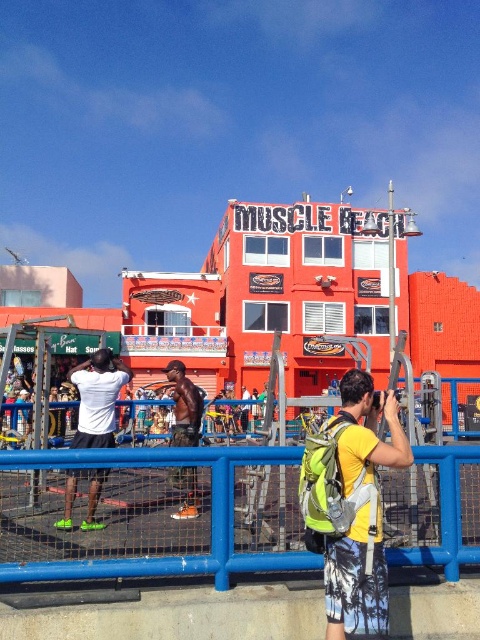
You are a photographer at Muscle Beach and need to capture both the black matte shorts at center and the shiny black shorts at center in a single frame. Which pair of shorts will appear smaller in the photo?

The black matte shorts at center will appear smaller in the photo because it has a smaller size compared to the shiny black shorts at center.

You are standing at Muscle Beach and see the blue metal fence at lower center and the black matte shorts at center. Which object is closer to you?

The blue metal fence at lower center is closer to you because it is in front of the black matte shorts at center.